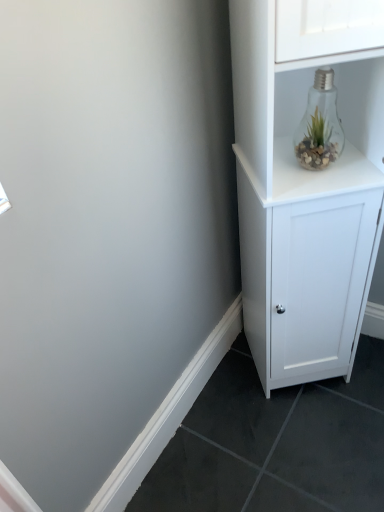
Question: Based on their sizes in the image, would you say clear glass light bulb at upper right is bigger or smaller than white matte cabinet at upper right?

Choices:
 (A) big
 (B) small

Answer: (B)

Question: From the image's perspective, relative to white matte cabinet at upper right, is clear glass light bulb at upper right above or below?

Choices:
 (A) above
 (B) below

Answer: (A)

Question: From a real-world perspective, is clear glass light bulb at upper right positioned above or below white matte cabinet at upper right?

Choices:
 (A) above
 (B) below

Answer: (A)

Question: Based on their positions, is white matte cabinet at upper right located to the left or right of clear glass light bulb at upper right?

Choices:
 (A) right
 (B) left

Answer: (A)

Question: Relative to clear glass light bulb at upper right, is white matte cabinet at upper right in front or behind?

Choices:
 (A) front
 (B) behind

Answer: (A)

Question: Do you think white matte cabinet at upper right is within clear glass light bulb at upper right, or outside of it?

Choices:
 (A) outside
 (B) inside

Answer: (A)

Question: Is white matte cabinet at upper right wider or thinner than clear glass light bulb at upper right?

Choices:
 (A) thin
 (B) wide

Answer: (B)